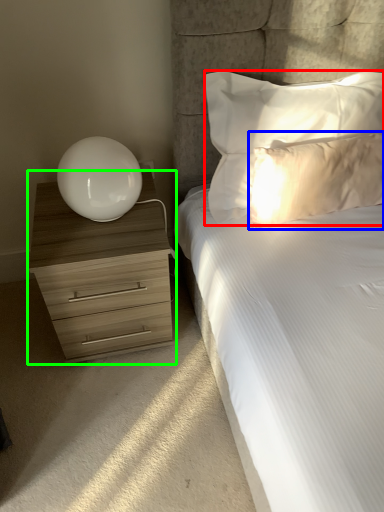
Question: Which object is the farthest from pillow (highlighted by a red box)? Choose among these: pillow (highlighted by a blue box) or chest of drawers (highlighted by a green box).

Choices:
 (A) pillow
 (B) chest of drawers

Answer: (B)